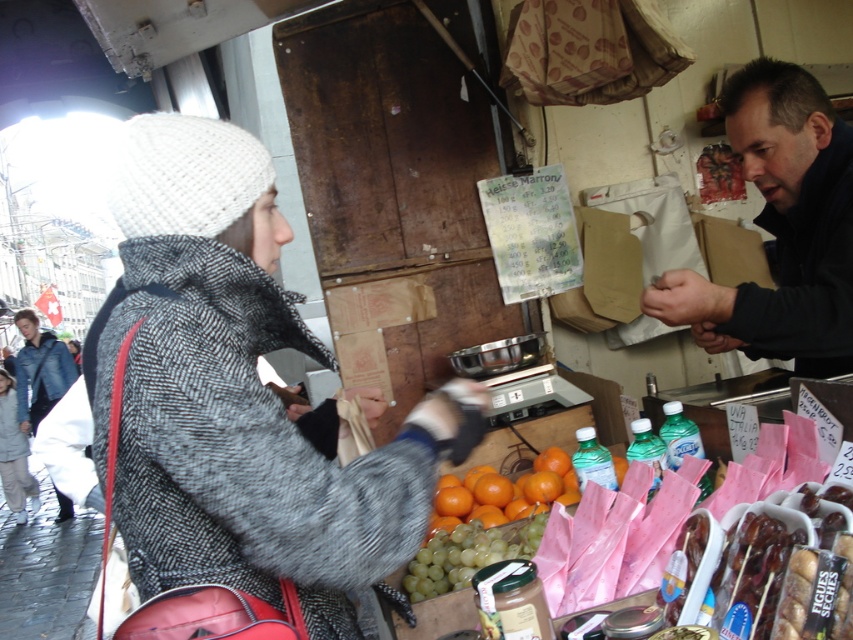
You are a photographer trying to capture both the dark blue jacket at upper right and the denim jacket at left in a single frame. Based on their sizes, which jacket will appear larger in the photo?

The denim jacket at left will appear larger in the photo because it is bigger than the dark blue jacket at upper right.

You are a photographer trying to capture a candid shot of the transaction between the knitted wool hat at upper left and the dark blue jacket at upper right. Since you want to focus on both individuals equally, which subject should you adjust your camera angle to prioritize? Explain your reasoning based on their positions.

The knitted wool hat at upper left is in front of the dark blue jacket at upper right. To ensure both are visible equally, the photographer should angle the camera slightly towards the dark blue jacket at upper right so that the knitted wool hat at upper left, being closer, doesn t block the view of the jacket.

You are a photographer standing at the back of the market. You want to take a photo of the knitted wool hat at upper left and the denim jacket at left. Which object will appear closer to the camera in the photo?

The knitted wool hat at upper left will appear closer to the camera because it is in front of the denim jacket at left.